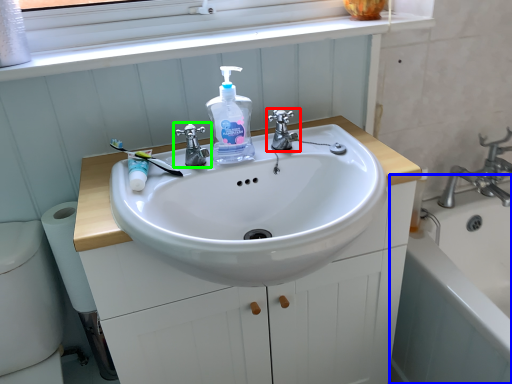
Question: Based on their relative distances, which object is nearer to tap (highlighted by a red box)? Choose from bath (highlighted by a blue box) and tap (highlighted by a green box).

Choices:
 (A) bath
 (B) tap

Answer: (B)